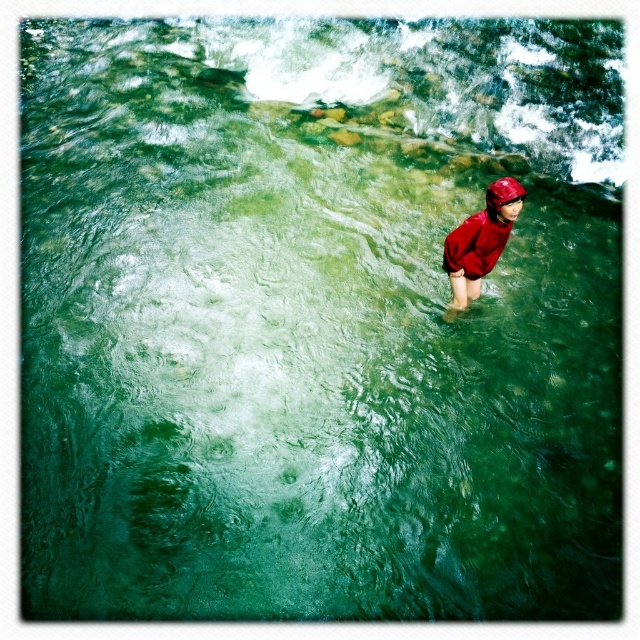
Find the location of a particular element. The height and width of the screenshot is (640, 640). matte red raincoat at center is located at coordinates (481, 241).

Does point (509, 177) come in front of point (508, 184)?

That is False.

Locate an element on the screen. The height and width of the screenshot is (640, 640). matte red raincoat at center is located at coordinates (481, 241).